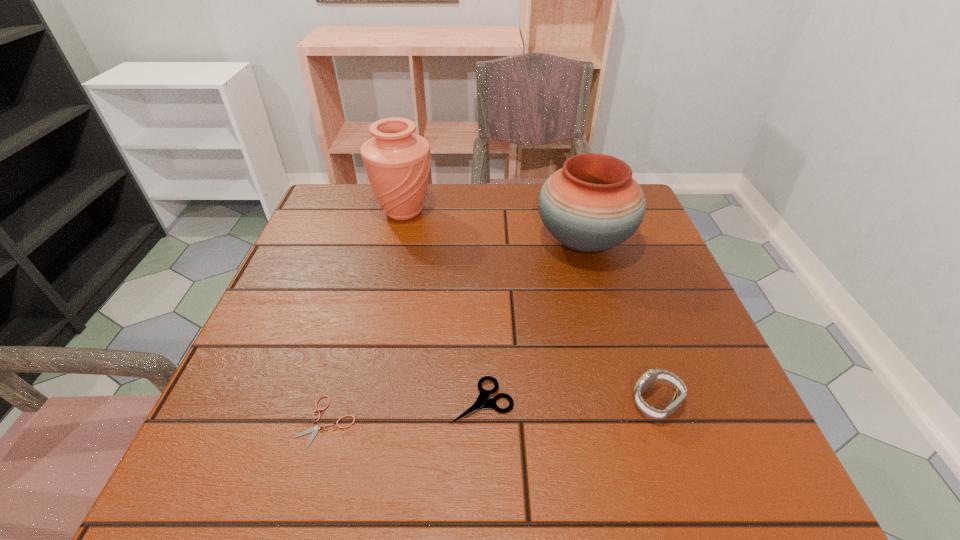
Identify the location of free space between the right shears and the vase. (443, 306).

Where is `unoccupied position between the second shortest object and the vase`? The height and width of the screenshot is (540, 960). unoccupied position between the second shortest object and the vase is located at coordinates (443, 306).

Image resolution: width=960 pixels, height=540 pixels. I want to click on empty location between the tallest object and the shortest object, so click(366, 316).

You are a GUI agent. You are given a task and a screenshot of the screen. Output one action in this format:
    pyautogui.click(x=<x>, y=<y>)
    Task: Click on the free space between the fourth shortest object and the watch
    
    Given the screenshot: What is the action you would take?
    pyautogui.click(x=620, y=322)

The width and height of the screenshot is (960, 540). I want to click on unoccupied position between the fourth shortest object and the fourth tallest object, so (533, 321).

The width and height of the screenshot is (960, 540). What are the coordinates of `vacant point located between the pottery and the watch` in the screenshot? It's located at (620, 322).

The height and width of the screenshot is (540, 960). I want to click on vacant region between the watch and the vase, so click(530, 307).

The height and width of the screenshot is (540, 960). In order to click on vacant region between the second shortest object and the vase in this screenshot , I will do `click(443, 306)`.

Where is `vacant area between the tallest object and the second shortest object`? vacant area between the tallest object and the second shortest object is located at coordinates (443, 306).

Identify which object is the second nearest to the fourth shortest object. Please provide its 2D coordinates. Your answer should be formatted as a tuple, i.e. [(x, y)], where the tuple contains the x and y coordinates of a point satisfying the conditions above.

[(651, 376)]